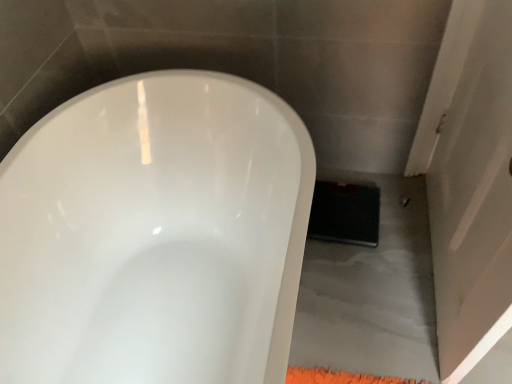
You are a GUI agent. You are given a task and a screenshot of the screen. Output one action in this format:
    pyautogui.click(x=<x>, y=<y>)
    Task: Click on the white glossy toilet at center
    The image size is (512, 384).
    Given the screenshot: What is the action you would take?
    pyautogui.click(x=155, y=234)

Describe the element at coordinates (155, 234) in the screenshot. I see `white glossy toilet at center` at that location.

The height and width of the screenshot is (384, 512). Identify the location of white glossy toilet at center. (155, 234).